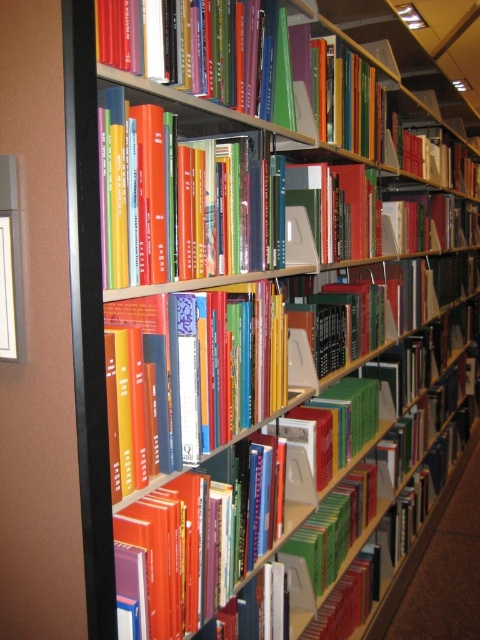
In the scene shown: You are standing in front of the library bookshelf and want to reach a point exactly at coordinate point (199, 250). If your arm can extend 3 feet, can you reach that point?

The distance between you and the point (199, 250) is 3.79 feet, which is beyond your arm reach of 3 feet. Therefore, you cannot reach it.

You are a librarian trying to organize books on a shelf. You have two hardcover books at center and a hardcover book at center. Which one is placed on top of the other?

The hardcover books at center is positioned over hardcover book at center, meaning the hardcover books at center is on top of the hardcover book at center.

You are standing in front of the bookshelf and want to find the hardcover books at center. According to the grid layout, where should you look relative to the bottom left corner of the bookshelf?

The hardcover books at center are located at the 2D coordinates point (183, 198) relative to the bottom left corner of the bookshelf.